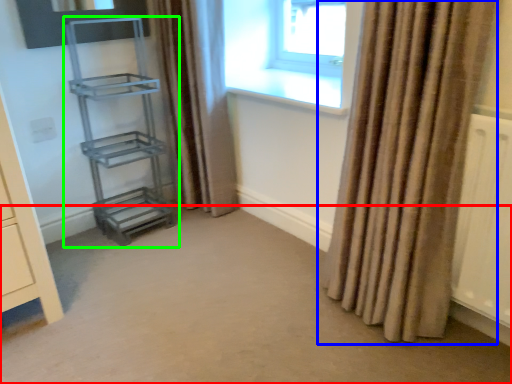
Question: Which is nearer to the plain (highlighted by a red box)? curtain (highlighted by a blue box) or shelf (highlighted by a green box).

Choices:
 (A) curtain
 (B) shelf

Answer: (A)